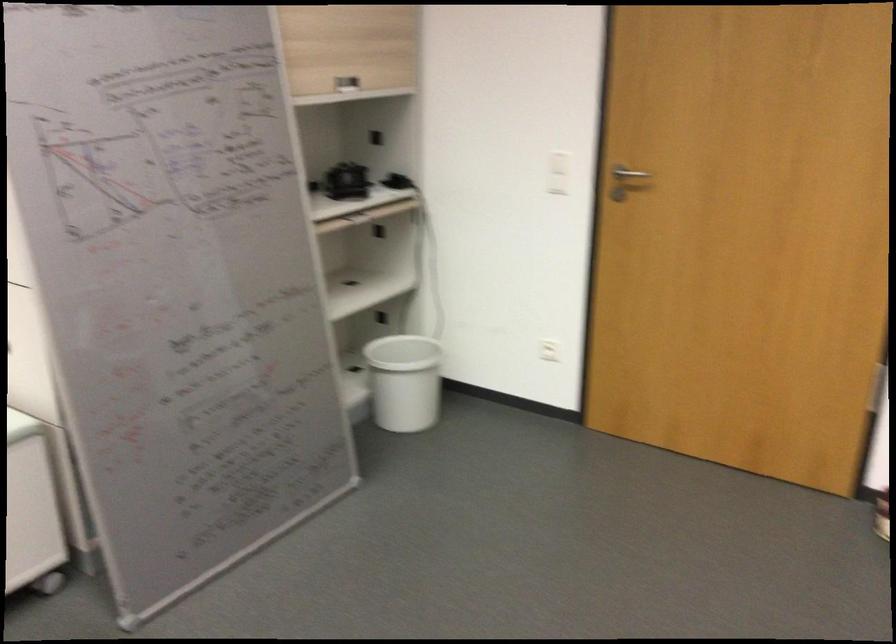
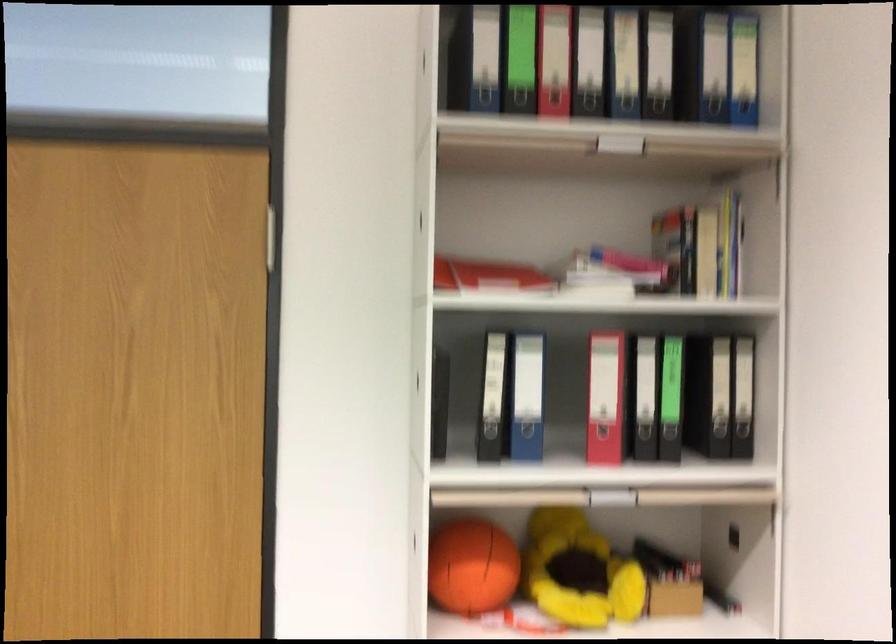
Question: The camera is either moving clockwise (left) or counter-clockwise (right) around the object. The first image is from the beginning of the video and the second image is from the end. Is the camera moving left or right when shooting the video?

Choices:
 (A) Left
 (B) Right

Answer: (A)